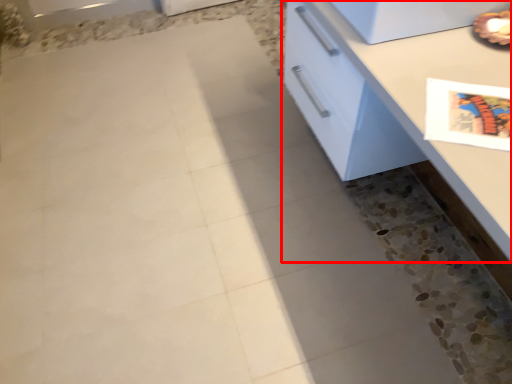
Question: Considering the relative positions of countertop (annotated by the red box) and appliance in the image provided, where is countertop (annotated by the red box) located with respect to the staircase?

Choices:
 (A) right
 (B) left

Answer: (A)